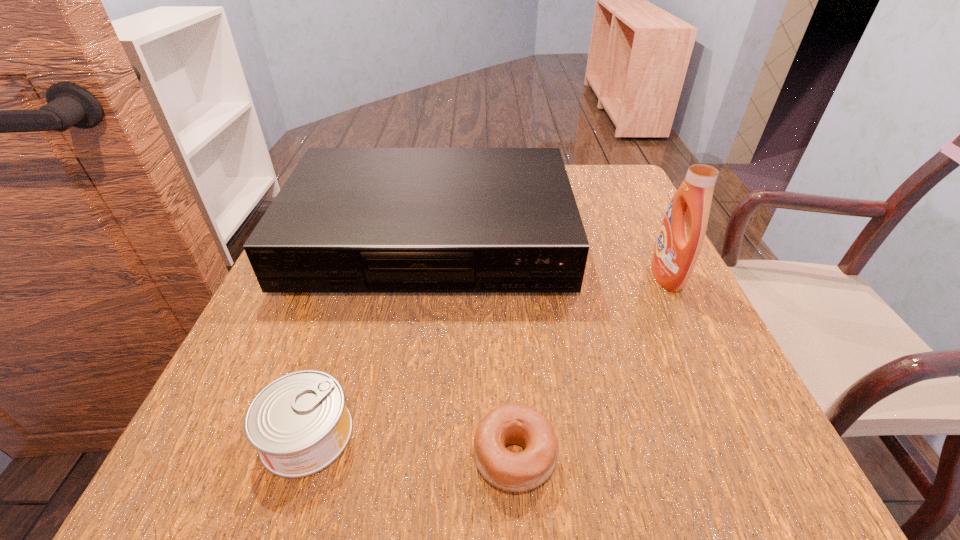
Where is `detergent`? The height and width of the screenshot is (540, 960). detergent is located at coordinates (681, 236).

Identify the location of the rightmost object. The image size is (960, 540). (681, 236).

You are a GUI agent. You are given a task and a screenshot of the screen. Output one action in this format:
    pyautogui.click(x=<x>, y=<y>)
    Task: Click on the second tallest object
    This screenshot has height=540, width=960.
    Given the screenshot: What is the action you would take?
    pyautogui.click(x=348, y=220)

Identify the location of the third tallest object. (299, 423).

This screenshot has width=960, height=540. What are the coordinates of `the shortest object` in the screenshot? It's located at (514, 423).

Image resolution: width=960 pixels, height=540 pixels. I want to click on vacant space located on the front-facing side of the rightmost object, so click(509, 276).

This screenshot has width=960, height=540. What are the coordinates of `vacant space located 0.340m on the front-facing side of the rightmost object` in the screenshot? It's located at (477, 276).

Image resolution: width=960 pixels, height=540 pixels. Identify the location of free space located 0.080m on the front-facing side of the rightmost object. (612, 276).

At what (x,y) coordinates should I click in order to perform the action: click on vacant space located 0.230m at the front of the second tallest object for disc insertion. Please return your answer as a coordinate pair (x, y). The width and height of the screenshot is (960, 540). Looking at the image, I should click on (406, 408).

At what (x,y) coordinates should I click in order to perform the action: click on vacant space positioned on the right of the second shortest object. Please return your answer as a coordinate pair (x, y). This screenshot has width=960, height=540. Looking at the image, I should click on (433, 434).